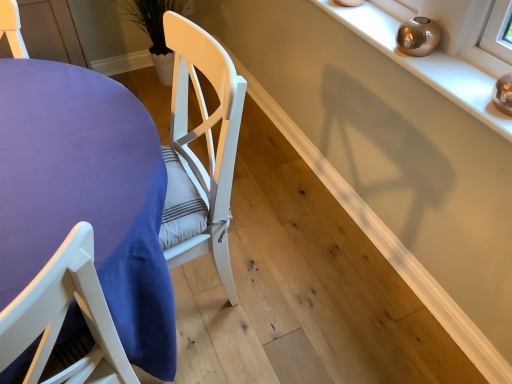
You are a GUI agent. You are given a task and a screenshot of the screen. Output one action in this format:
    pyautogui.click(x=<x>, y=<y>)
    Task: Click on the empty space that is ontop of metallic gold orb at upper right
    This screenshot has width=512, height=384.
    Given the screenshot: What is the action you would take?
    pyautogui.click(x=416, y=51)